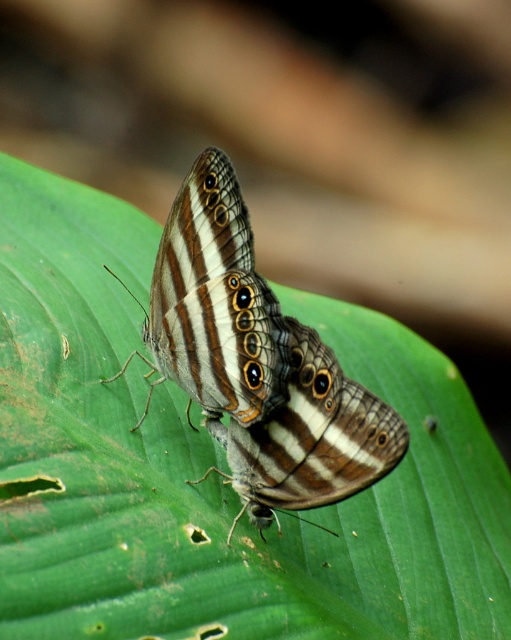
You are a photographer trying to capture a closeup of the butterflies on the leaf. You notice two points marked on the leaf where the butterflies are resting. The first point is at coordinate point [203,172] and the second is at point [276,458]. If you want to focus on the butterfly that is closer to you, which point should you aim your camera at?

Point [276,458] is closer to you than point [203,172], so you should aim your camera at point [276,458] to focus on the butterfly that is closer.